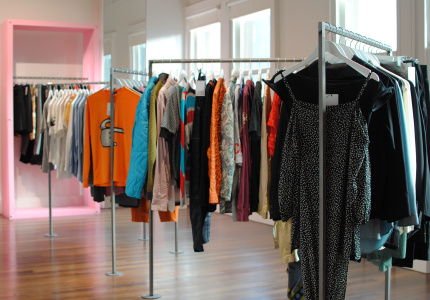
Locate an element on the screen. Image resolution: width=430 pixels, height=300 pixels. base of clothing rack is located at coordinates (150, 295), (110, 268), (46, 230).